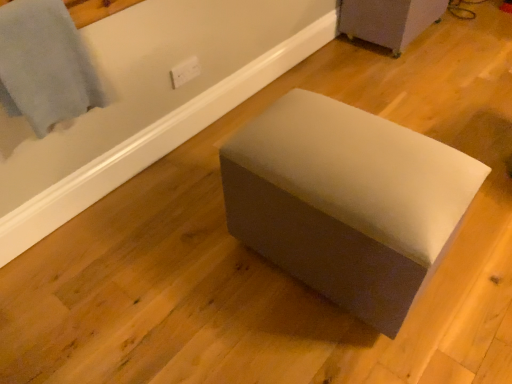
This screenshot has height=384, width=512. In order to click on blank space situated above suede-like gray ottoman at center, arranged as the second furniture when viewed from the right (from a real-world perspective) in this screenshot , I will do `click(351, 138)`.